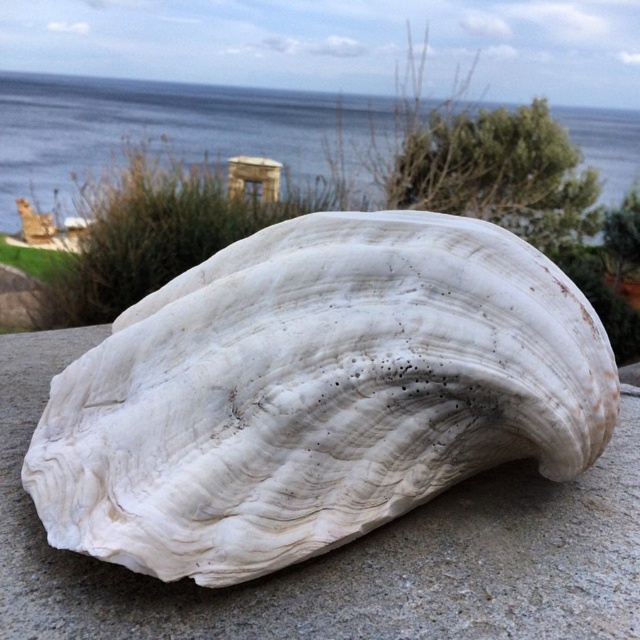
Question: Among these points, which one is farthest from the camera?

Choices:
 (A) (212, 104)
 (B) (490, 308)

Answer: (A)

Question: Does white marble shell at center have a larger size compared to blue water at upper center?

Choices:
 (A) yes
 (B) no

Answer: (A)

Question: Can you confirm if white marble shell at center is positioned to the left of blue water at upper center?

Choices:
 (A) no
 (B) yes

Answer: (A)

Question: Is white marble shell at center wider than blue water at upper center?

Choices:
 (A) yes
 (B) no

Answer: (B)

Question: Which point is farther to the camera?

Choices:
 (A) blue water at upper center
 (B) white marble shell at center

Answer: (A)